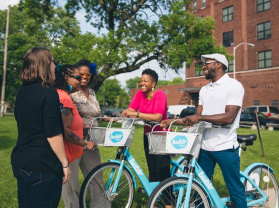
Find the location of a particular element. The image size is (279, 208). basket is located at coordinates (172, 143), (107, 138).